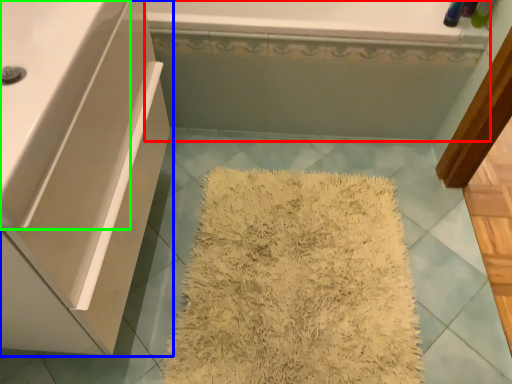
Question: Which object is the closest to the bath (highlighted by a red box)? Choose among these: bathroom cabinet (highlighted by a blue box) or counter top (highlighted by a green box).

Choices:
 (A) bathroom cabinet
 (B) counter top

Answer: (A)